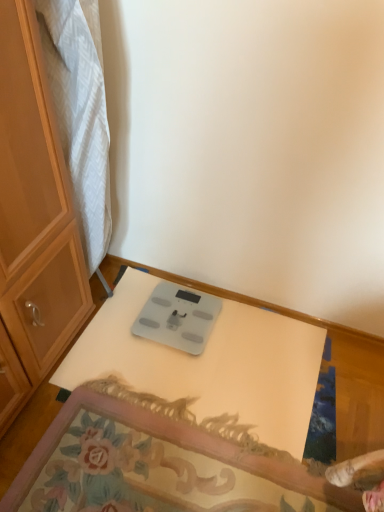
Locate an element on the screen. This screenshot has width=384, height=512. vacant area that is in front of matte wood cabinet at left is located at coordinates (110, 335).